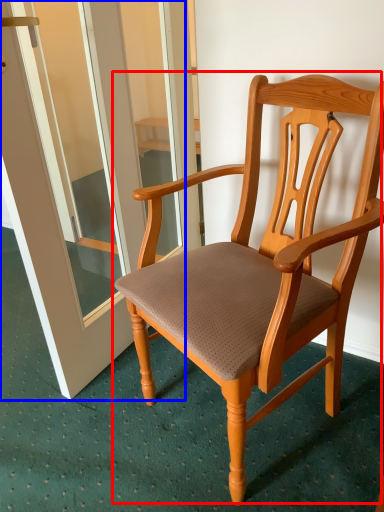
Question: Which of the following is the farthest to the observer, chair (highlighted by a red box) or screen door (highlighted by a blue box)?

Choices:
 (A) chair
 (B) screen door

Answer: (B)